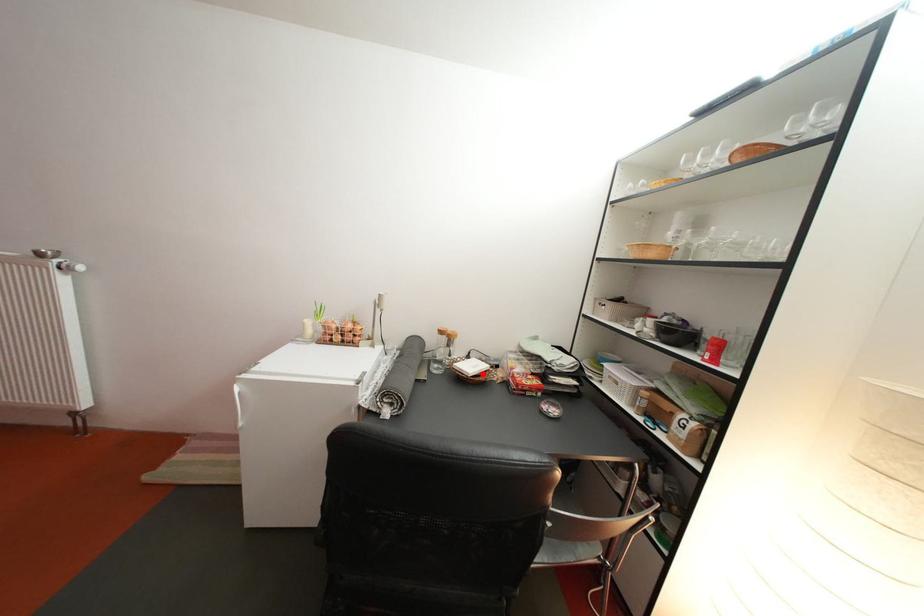
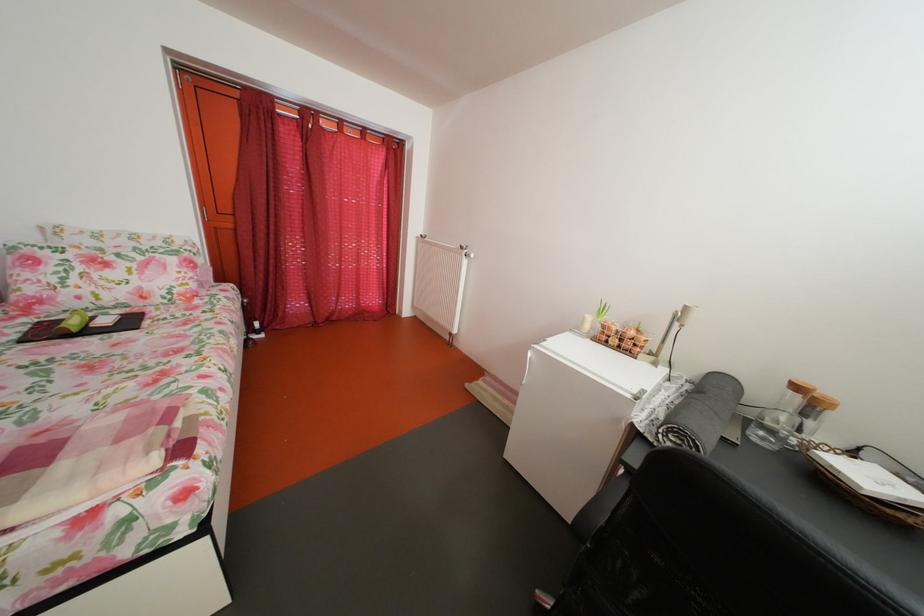
Question: I am providing you with two images of the same scene from different viewpoints. A red point is marked on the first image. At the location where the point appears in image 1, is it still visible in image 2?

Choices:
 (A) Yes
 (B) No

Answer: (A)